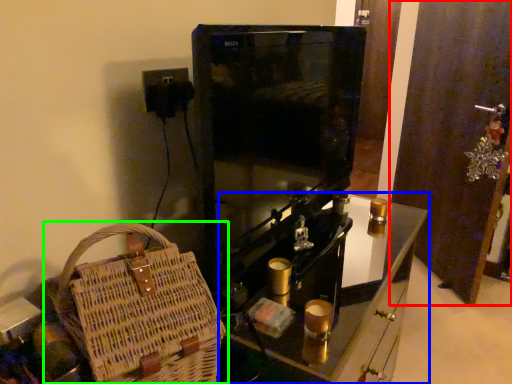
Question: Considering the real-world distances, which object is farthest from door (highlighted by a red box)? furniture (highlighted by a blue box) or handbag (highlighted by a green box)?

Choices:
 (A) furniture
 (B) handbag

Answer: (B)